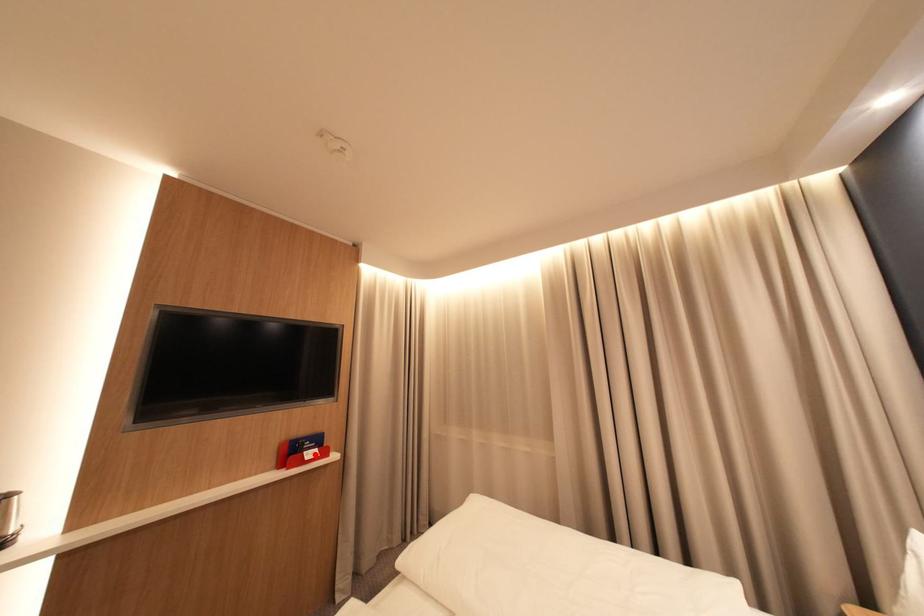
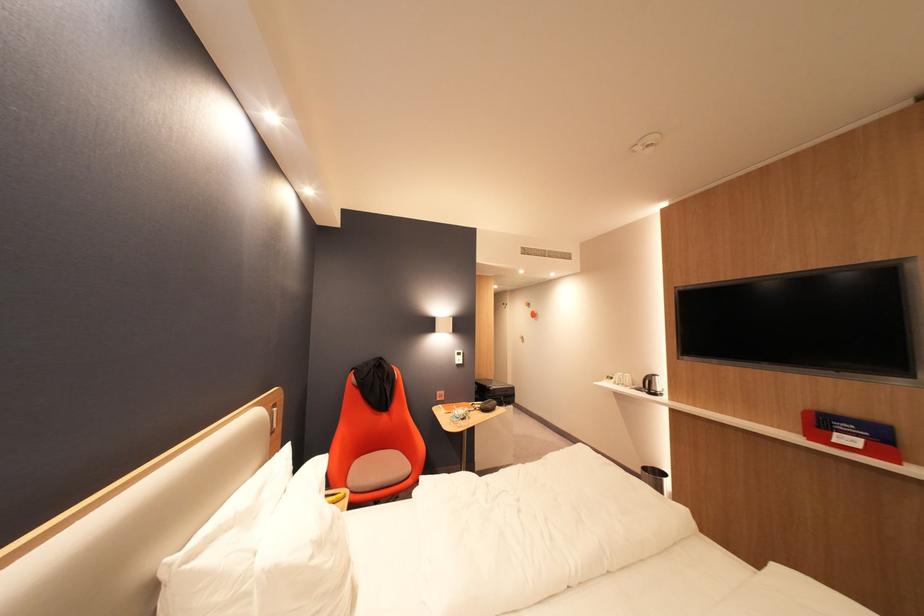
Question: I am providing you with two images of the same scene from different viewpoints. Image1 has a red point marked. In image2, the corresponding 3D location appears at what relative position? Reply with the corresponding letter.

Choices:
 (A) Closer
 (B) Farther

Answer: (A)